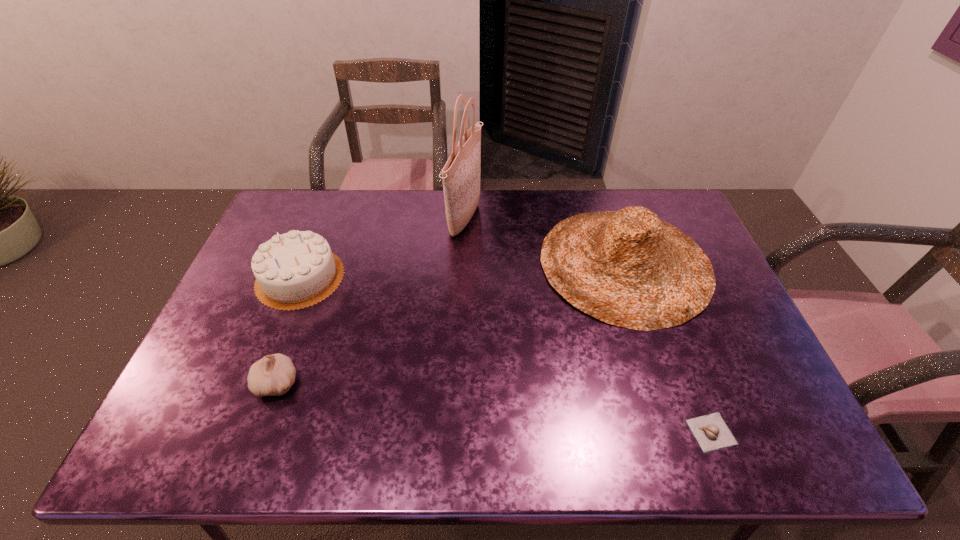
Identify the location of vacant space located on the back of the third shortest object. This screenshot has width=960, height=540. (318, 232).

Where is `free spot located 0.120m on the back of the fourth farthest object`? The image size is (960, 540). free spot located 0.120m on the back of the fourth farthest object is located at coordinates (297, 327).

The height and width of the screenshot is (540, 960). I want to click on free location located on the left of the nearest object, so click(x=574, y=432).

Where is `shopping bag located at the far edge`? The height and width of the screenshot is (540, 960). shopping bag located at the far edge is located at coordinates (461, 174).

What are the coordinates of `sunhat that is positioned at the far edge` in the screenshot? It's located at (628, 268).

Identify the location of object positioned at the near edge. (711, 432).

The image size is (960, 540). Find the location of `object present at the left edge`. object present at the left edge is located at coordinates (295, 270).

At what (x,y) coordinates should I click in order to perform the action: click on sunhat located at the right edge. Please return your answer as a coordinate pair (x, y). The image size is (960, 540). Looking at the image, I should click on (628, 268).

Locate an element on the screen. The width and height of the screenshot is (960, 540). garlic that is at the right edge is located at coordinates point(711,432).

Locate an element on the screen. object that is positioned at the far right corner is located at coordinates (628, 268).